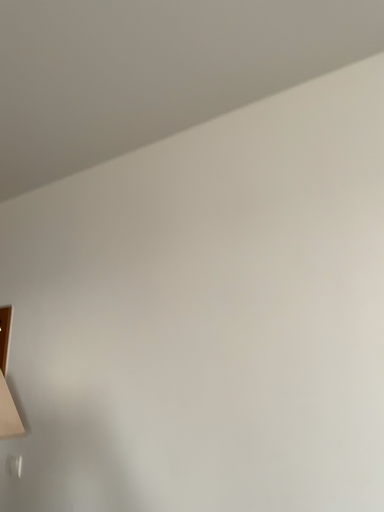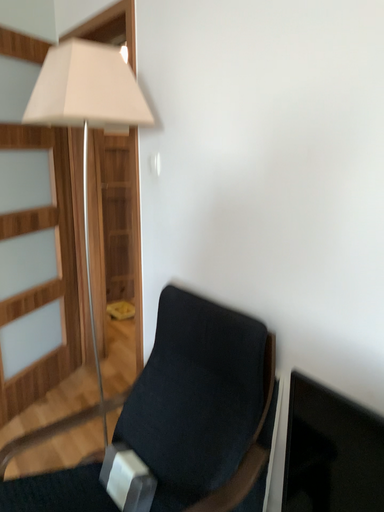
Question: How did the camera likely rotate when shooting the video?

Choices:
 (A) rotated right
 (B) rotated left

Answer: (B)